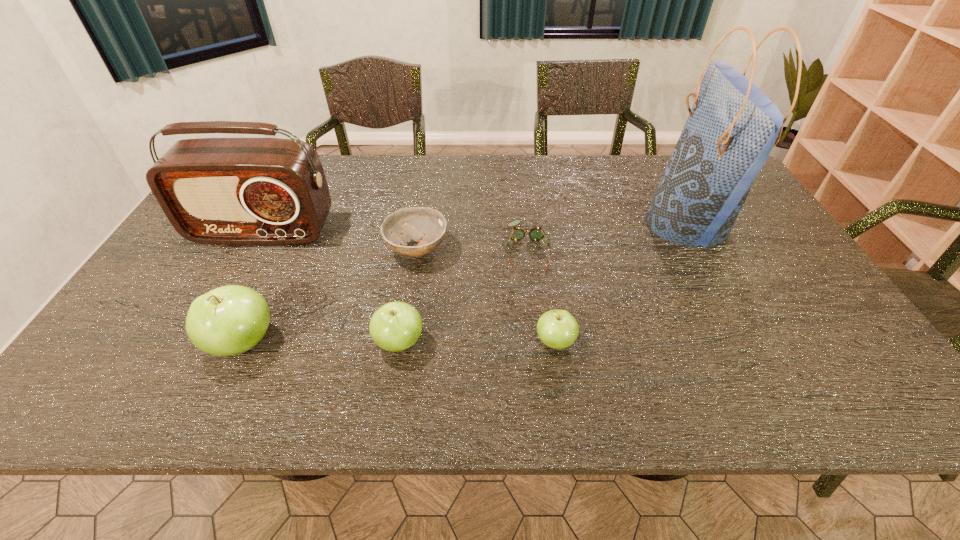
Where is `vacant area situated on the left of the leftmost apple`? vacant area situated on the left of the leftmost apple is located at coordinates (158, 343).

Where is `vacant point located on the left of the second apple from left to right`? vacant point located on the left of the second apple from left to right is located at coordinates (271, 342).

The image size is (960, 540). Identify the location of vacant space located on the right of the shortest apple. (691, 342).

Locate an element on the screen. free space located 0.080m on the right of the rightmost object is located at coordinates (755, 224).

Find the location of a particular element. The image size is (960, 540). vacant space positioned 0.080m on the front-facing side of the spectacles is located at coordinates (533, 294).

Where is `free space located 0.070m on the front panel of the second tallest object`? Image resolution: width=960 pixels, height=540 pixels. free space located 0.070m on the front panel of the second tallest object is located at coordinates (245, 264).

Identify the location of vacant space located on the front of the bowl. (409, 300).

Image resolution: width=960 pixels, height=540 pixels. In order to click on object situated at the far edge in this screenshot , I will do `click(732, 127)`.

This screenshot has width=960, height=540. I want to click on object present at the left edge, so click(x=227, y=191).

Image resolution: width=960 pixels, height=540 pixels. In order to click on object located at the right edge in this screenshot , I will do `click(732, 127)`.